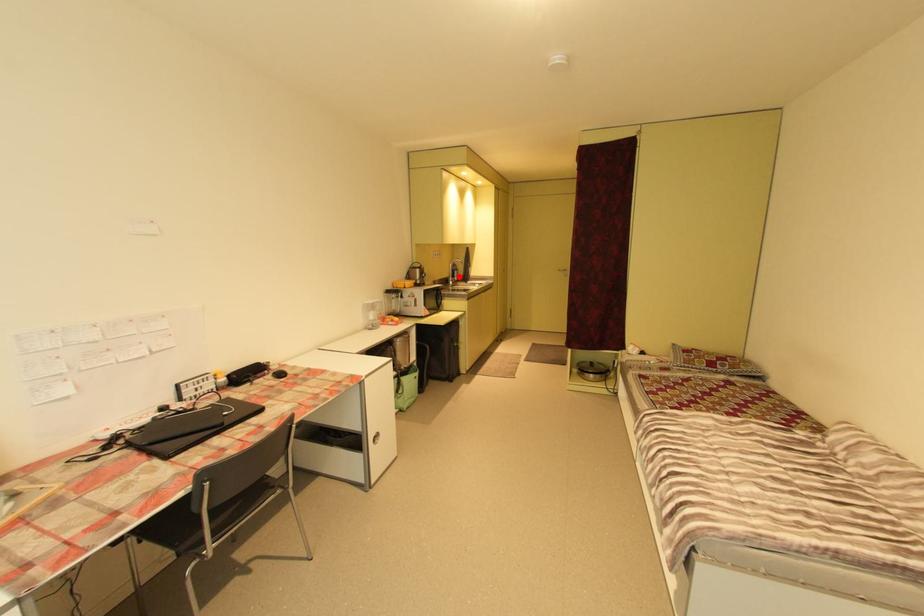
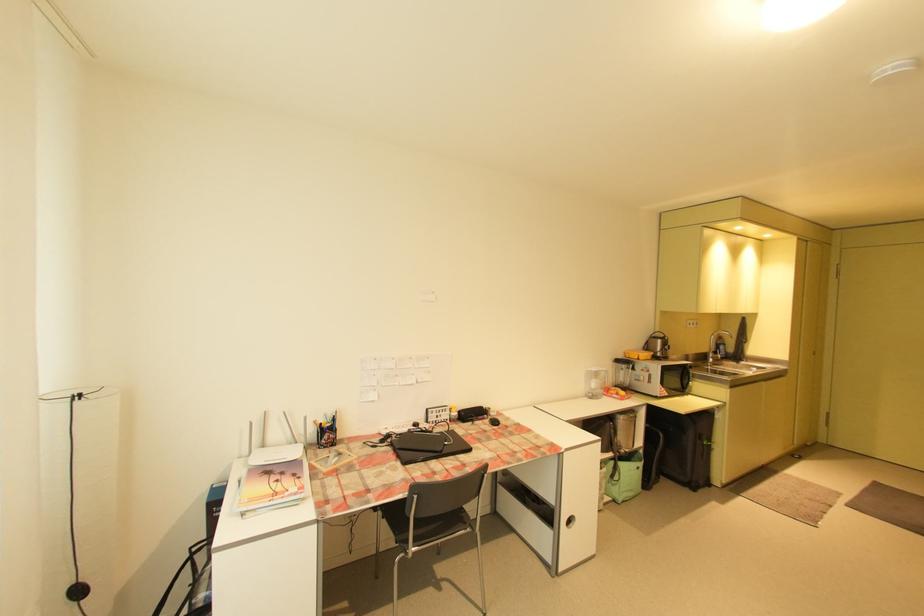
Find the pixel in the second image that matches the highlighted location in the first image.

(722, 353)